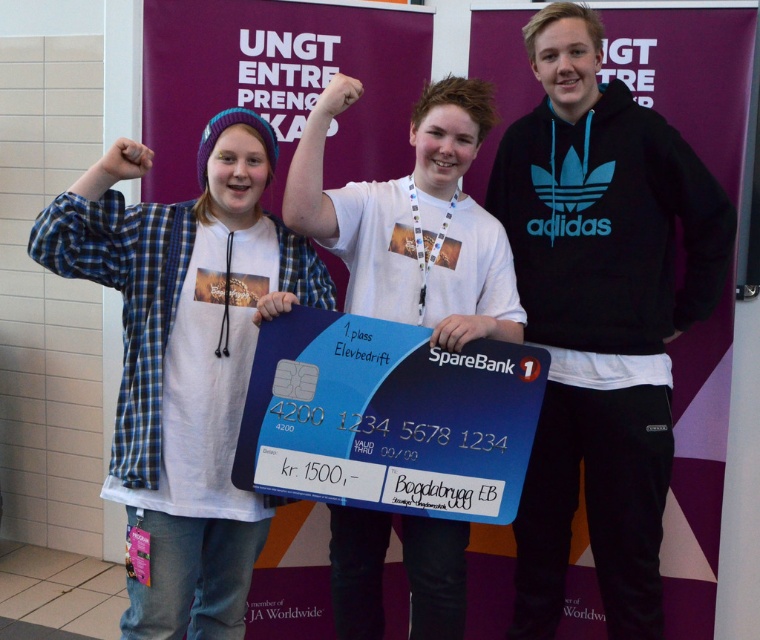
You are standing in the room where the event is taking place. You need to hand a document to the person wearing the black fleece sweatshirt at right. If you are currently 3 meters away from them, is the distance sufficient to reach them without moving closer?

The distance of black fleece sweatshirt at right from viewer is 2.49 meters. Since you are currently 3 meters away, you are farther than the required distance. You need to move closer to reach them.